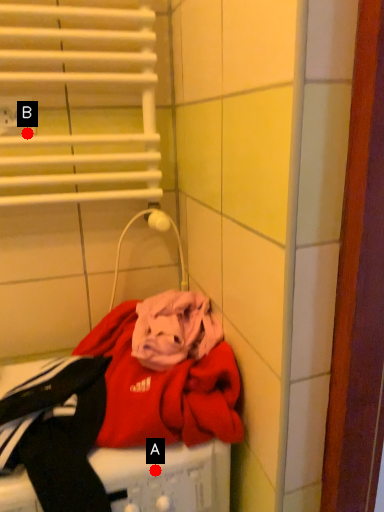
Question: Two points are circled on the image, labeled by A and B beside each circle. Which point is closer to the camera?

Choices:
 (A) A is closer
 (B) B is closer

Answer: (A)